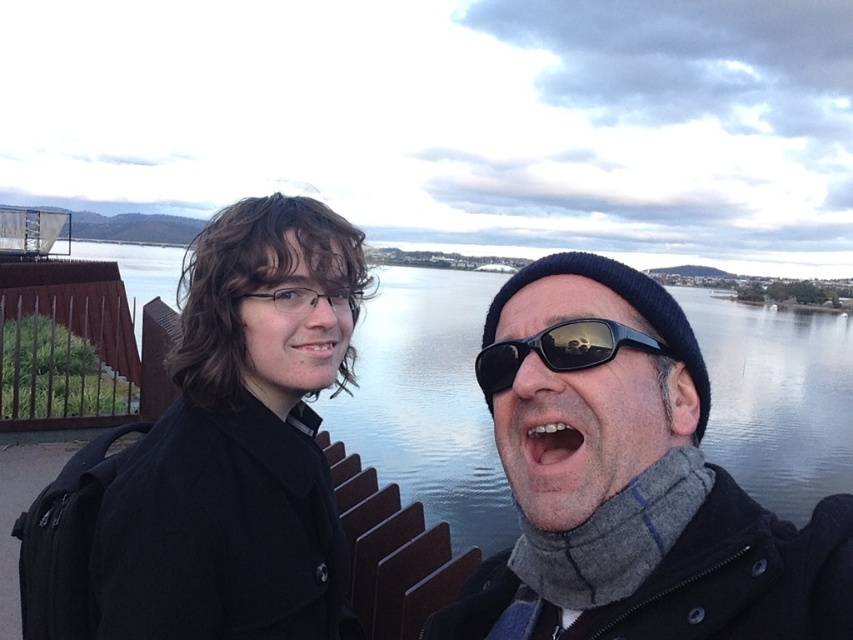
Question: Does matte black sunglasses at center lie in front of white glossy teeth at center?

Choices:
 (A) no
 (B) yes

Answer: (B)

Question: Which object is farther from the camera taking this photo?

Choices:
 (A) matte skin mouth at center
 (B) white glossy teeth at center
 (C) matte black sunglasses at center

Answer: (A)

Question: Which object appears closest to the camera in this image?

Choices:
 (A) matte black coat at center
 (B) matte skin mouth at center

Answer: (A)

Question: Estimate the real-world distances between objects in this image. Which object is farther from the matte black coat at center?

Choices:
 (A) black reflective sunglasses at center
 (B) white glossy teeth at center
 (C) matte black sunglasses at center
 (D) matte skin mouth at center

Answer: (B)

Question: Does matte black coat at center appear under matte skin mouth at center?

Choices:
 (A) yes
 (B) no

Answer: (A)

Question: In this image, where is matte black coat at center located relative to black reflective sunglasses at center?

Choices:
 (A) left
 (B) right

Answer: (A)